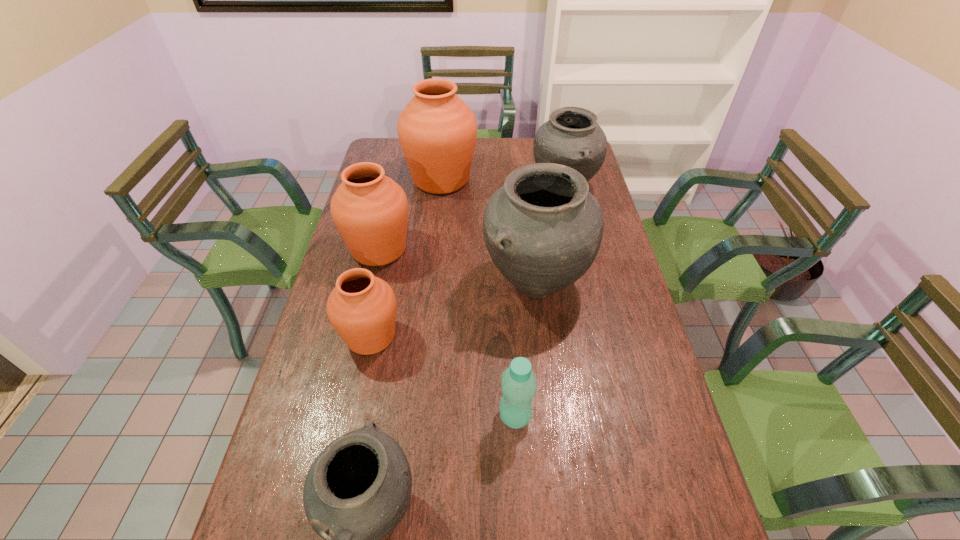
Where is `the farthest brown urn`? This screenshot has width=960, height=540. the farthest brown urn is located at coordinates (437, 131).

Find the location of a particular element. the biggest black urn is located at coordinates pos(543,229).

This screenshot has height=540, width=960. I want to click on the second biggest brown urn, so click(x=370, y=210).

Identify the location of the second biggest black urn. The image size is (960, 540). (572, 137).

Identify the location of the smallest brown urn. Image resolution: width=960 pixels, height=540 pixels. (362, 308).

Identify the location of the second nearest object. This screenshot has width=960, height=540. (519, 386).

Where is `free spot located 0.280m on the right of the farthest brown urn`? free spot located 0.280m on the right of the farthest brown urn is located at coordinates (547, 179).

Where is `vacant space located 0.180m on the back of the second nearest black urn`? vacant space located 0.180m on the back of the second nearest black urn is located at coordinates (527, 214).

Find the location of a particular element. The width and height of the screenshot is (960, 540). free space located on the back of the second smallest brown urn is located at coordinates (389, 210).

I want to click on free space located 0.260m on the left of the farthest black urn, so [x=464, y=188].